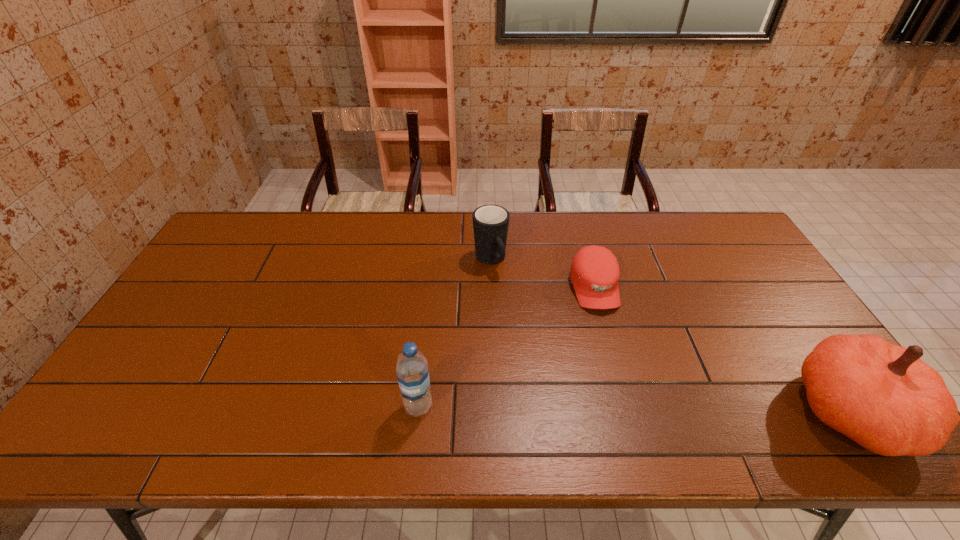
I want to click on empty space between the third object from left to right and the mug, so click(542, 274).

Where is `empty space that is in between the shortest object and the water bottle`? empty space that is in between the shortest object and the water bottle is located at coordinates (506, 347).

Where is `vacant area that lies between the third object from right to left and the leftmost object`? Image resolution: width=960 pixels, height=540 pixels. vacant area that lies between the third object from right to left and the leftmost object is located at coordinates (454, 334).

Find the location of a particular element. This screenshot has height=540, width=960. vacant space in between the mug and the third object from left to right is located at coordinates (542, 274).

What are the coordinates of `vacant space that's between the leftmost object and the third tallest object` in the screenshot? It's located at (454, 334).

Identify the location of vacant region between the water bottle and the pumpkin. The width and height of the screenshot is (960, 540). (636, 409).

Where is `object that is the closest one to the water bottle`? The width and height of the screenshot is (960, 540). object that is the closest one to the water bottle is located at coordinates (490, 222).

Find the location of `object that is the third closest to the cap`. object that is the third closest to the cap is located at coordinates (412, 372).

Image resolution: width=960 pixels, height=540 pixels. I want to click on free space that satisfies the following two spatial constraints: 1. on the front side of the third tallest object; 2. on the front-facing side of the rightmost object, so click(x=494, y=411).